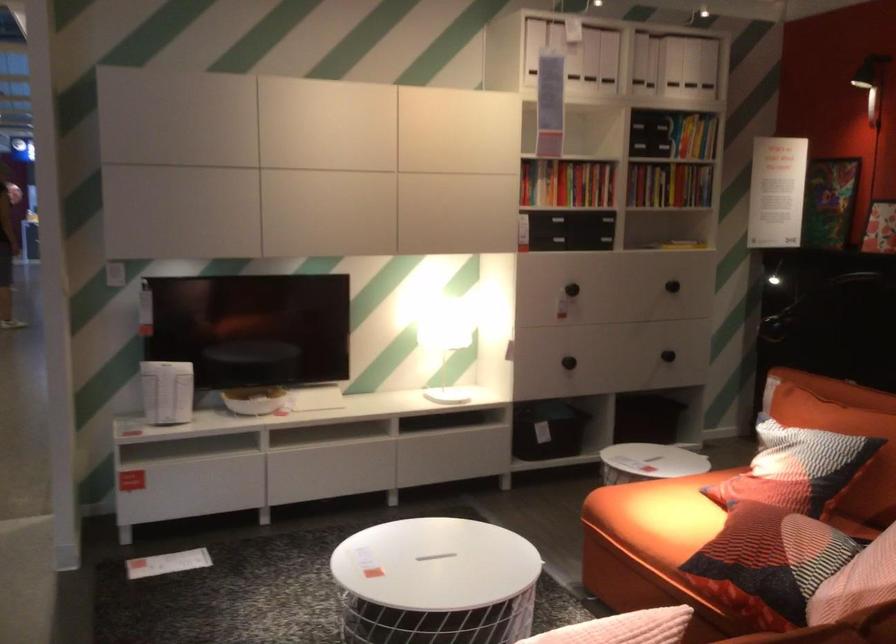
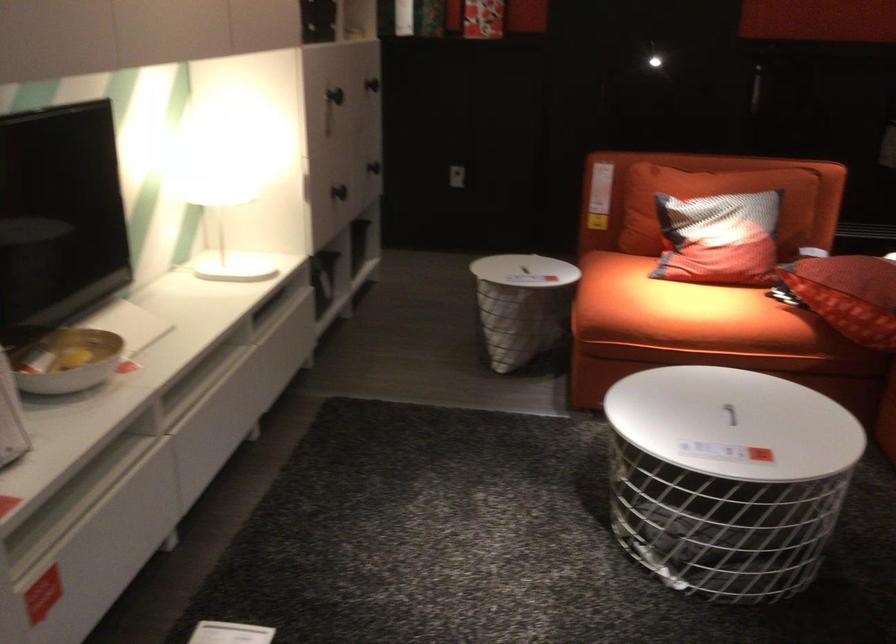
In the second image, find the point that corresponds to (442,328) in the first image.

(199, 198)